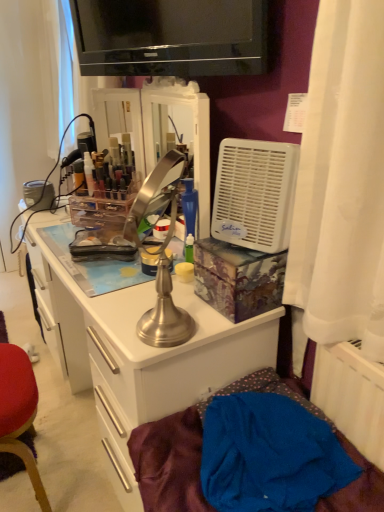
Question: From the image's perspective, is brushed metal desk at center on brushed metal table lamp at center?

Choices:
 (A) yes
 (B) no

Answer: (B)

Question: From a real-world perspective, is brushed metal desk at center over brushed metal table lamp at center?

Choices:
 (A) yes
 (B) no

Answer: (B)

Question: Considering the relative positions of brushed metal desk at center and brushed metal table lamp at center in the image provided, is brushed metal desk at center behind brushed metal table lamp at center?

Choices:
 (A) yes
 (B) no

Answer: (A)

Question: Considering the relative sizes of brushed metal desk at center and brushed metal table lamp at center in the image provided, is brushed metal desk at center shorter than brushed metal table lamp at center?

Choices:
 (A) yes
 (B) no

Answer: (B)

Question: Is brushed metal desk at center positioned with its back to brushed metal table lamp at center?

Choices:
 (A) yes
 (B) no

Answer: (B)

Question: Considering the relative sizes of brushed metal desk at center and brushed metal table lamp at center in the image provided, is brushed metal desk at center bigger than brushed metal table lamp at center?

Choices:
 (A) yes
 (B) no

Answer: (A)

Question: Does brushed metal table lamp at center have a smaller size compared to white plastic air conditioner at right?

Choices:
 (A) yes
 (B) no

Answer: (B)

Question: Can you confirm if brushed metal table lamp at center is taller than white plastic air conditioner at right?

Choices:
 (A) no
 (B) yes

Answer: (B)

Question: Is brushed metal table lamp at center aimed at white plastic air conditioner at right?

Choices:
 (A) yes
 (B) no

Answer: (B)

Question: Is brushed metal table lamp at center wider than white plastic air conditioner at right?

Choices:
 (A) yes
 (B) no

Answer: (B)

Question: Is brushed metal table lamp at center shorter than white plastic air conditioner at right?

Choices:
 (A) yes
 (B) no

Answer: (B)

Question: Is brushed metal table lamp at center further to the viewer compared to white plastic air conditioner at right?

Choices:
 (A) yes
 (B) no

Answer: (B)

Question: From a real-world perspective, does white plastic air conditioner at right sit lower than black glossy television at upper center?

Choices:
 (A) no
 (B) yes

Answer: (B)